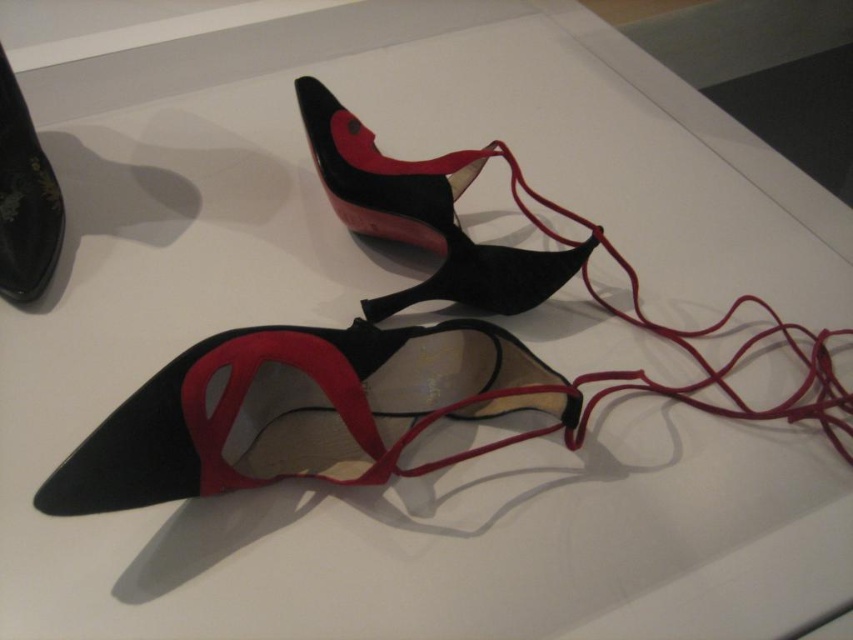
In the scene shown: You are standing in front of an exhibition display featuring a pair of high heels. There is a point marked at coordinates point (253, 481). Considering the display is designed for visitors to view from a safe distance, would you say this point is within a comfortable viewing range for most people?

The point (253, 481) is 4.28 feet away from the viewer, which is within a comfortable viewing range for most people as it allows for clear observation without being too close.

You are standing in front of an exhibition display. There is a point marked at coordinates point (x=643, y=314). Can you reach this point with your outstretched hand if your arm is 0.8 meters long?

The point (x=643, y=314) is 1.44 meters away from the viewer. Since your arm is only 0.8 meters long, you cannot reach it with your outstretched hand.